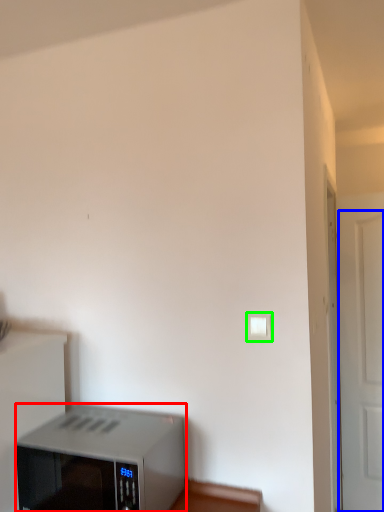
Question: Estimate the real-world distances between objects in this image. Which object is farther from home appliance (highlighted by a red box), door (highlighted by a blue box) or light switch (highlighted by a green box)?

Choices:
 (A) door
 (B) light switch

Answer: (A)